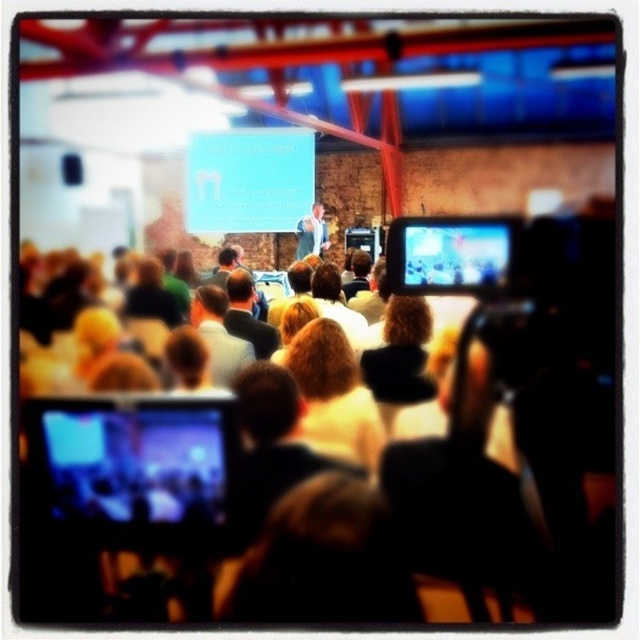
Question: Which of the following is the farthest from the observer?

Choices:
 (A) blue glossy projector screen at upper center
 (B) light brown leather jacket at center
 (C) blonde hair at center

Answer: (B)

Question: Where is matte black laptop at upper center located in relation to light brown leather jacket at center in the image?

Choices:
 (A) above
 (B) below

Answer: (B)

Question: Can you confirm if matte black monitor at center is positioned to the right of dark gray suit at center?

Choices:
 (A) no
 (B) yes

Answer: (B)

Question: Does blonde hair at center appear under light brown leather jacket at center?

Choices:
 (A) yes
 (B) no

Answer: (A)

Question: Which object is closer to the camera taking this photo?

Choices:
 (A) dark gray suit at center
 (B) light brown leather jacket at center

Answer: (A)

Question: Among these points, which one is farthest from the camera?

Choices:
 (A) (282, 228)
 (B) (326, 380)
 (C) (314, 218)
 (D) (465, 237)

Answer: (C)